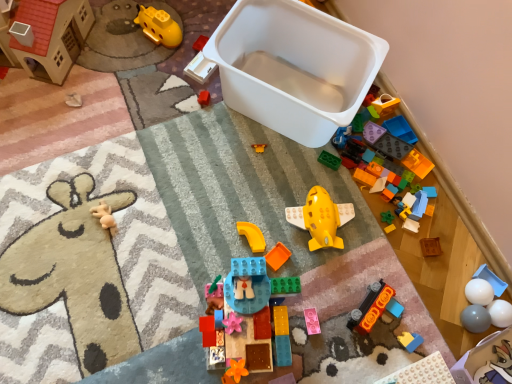
The image size is (512, 384). In order to click on free space in front of cardboard house at upper left, the 1th toy positioned from the left in this screenshot , I will do `click(36, 121)`.